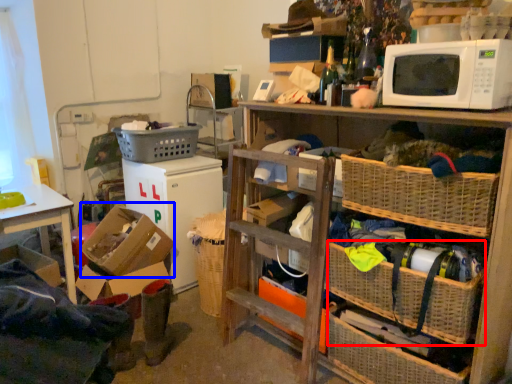
Question: Which point is further to the camera, basket (highlighted by a red box) or box (highlighted by a blue box)?

Choices:
 (A) basket
 (B) box

Answer: (B)